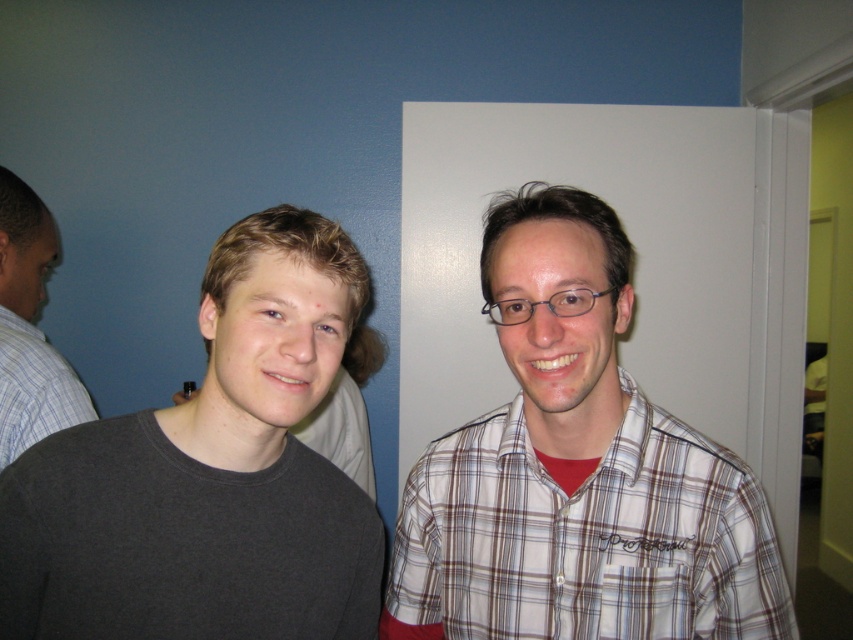
You are a photographer adjusting camera settings for a group photo. You notice two shirts in the scene described. Which shirt is shorter in height between the dark gray matte shirt at left and the gray cotton shirt at left?

The dark gray matte shirt at left is shorter in height compared to the gray cotton shirt at left.

You are taking a photo of two people in a room. You notice two points marked in the image. The first point is at coordinates point (291, 321) and the second is at point (494, 561). Which of these points is nearer to the camera?

Point (291, 321) is closer to the camera than point (494, 561).